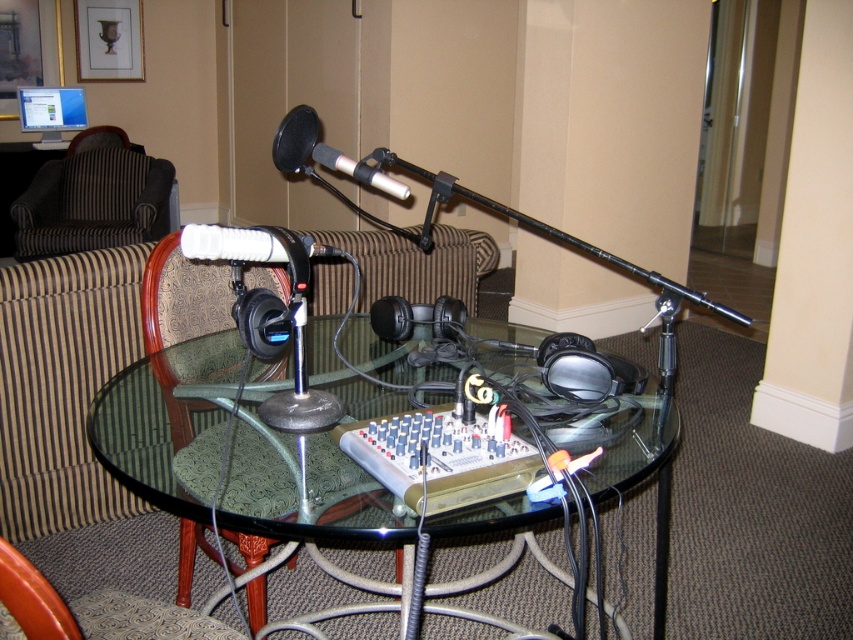
Question: Which object appears closest to the camera in this image?

Choices:
 (A) transparent glass table at center
 (B) green fabric armchair at lower left
 (C) black matte headphones at center

Answer: (A)

Question: Is green fabric armchair at lower left to the left of matte black microphone at center from the viewer's perspective?

Choices:
 (A) yes
 (B) no

Answer: (A)

Question: Which point is closer to the camera taking this photo?

Choices:
 (A) (86, 134)
 (B) (447, 307)
 (C) (138, 417)
 (D) (375, 173)

Answer: (C)

Question: Which point appears closest to the camera in this image?

Choices:
 (A) (288, 152)
 (B) (123, 132)
 (C) (128, 230)

Answer: (A)

Question: Can you confirm if green fabric armchair at lower left is thinner than matte black microphone at center?

Choices:
 (A) yes
 (B) no

Answer: (B)

Question: Can you confirm if striped fabric armchair at left is positioned to the left of brown striped armchair at upper left?

Choices:
 (A) no
 (B) yes

Answer: (A)